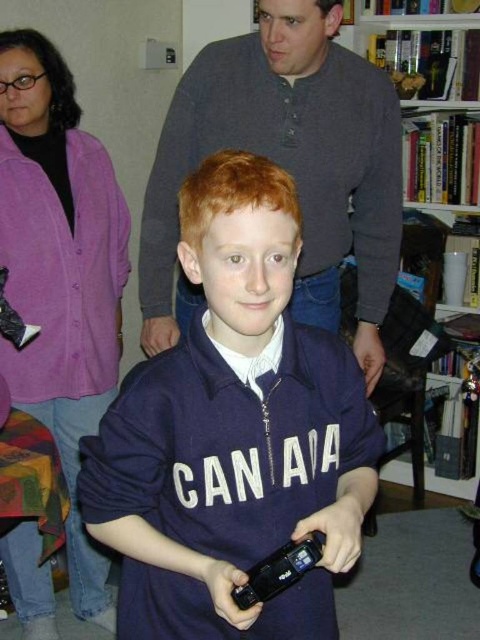
Question: From the image, what is the correct spatial relationship of navy blue zip-up sweater at center in relation to hardcover books at upper right?

Choices:
 (A) below
 (B) above

Answer: (A)

Question: Estimate the real-world distances between objects in this image. Which object is closer to the navy blue zip-up sweater at center?

Choices:
 (A) dark gray sweater at upper center
 (B) hardcover books at upper right

Answer: (A)

Question: Considering the relative positions of navy blue zip-up sweater at center and dark gray sweater at upper center in the image provided, where is navy blue zip-up sweater at center located with respect to dark gray sweater at upper center?

Choices:
 (A) above
 (B) below

Answer: (B)

Question: Which point appears closest to the camera in this image?

Choices:
 (A) (472, 170)
 (B) (129, 560)

Answer: (B)

Question: Can you confirm if navy blue zip-up sweater at center is bigger than dark gray sweater at upper center?

Choices:
 (A) yes
 (B) no

Answer: (B)

Question: Which of these objects is positioned closest to the navy blue zip-up sweater at center?

Choices:
 (A) hardcover books at upper right
 (B) dark gray sweater at upper center

Answer: (B)